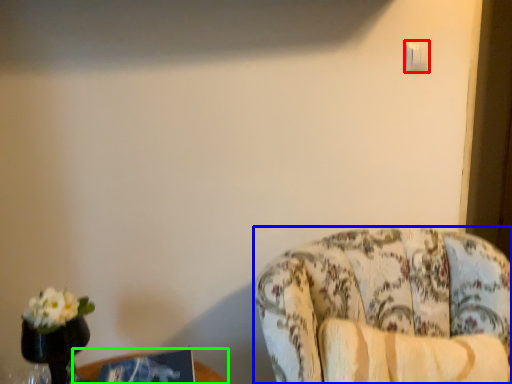
Question: Based on their relative distances, which object is nearer to light switch (highlighted by a red box)? Choose from chair (highlighted by a blue box) and table (highlighted by a green box).

Choices:
 (A) chair
 (B) table

Answer: (A)